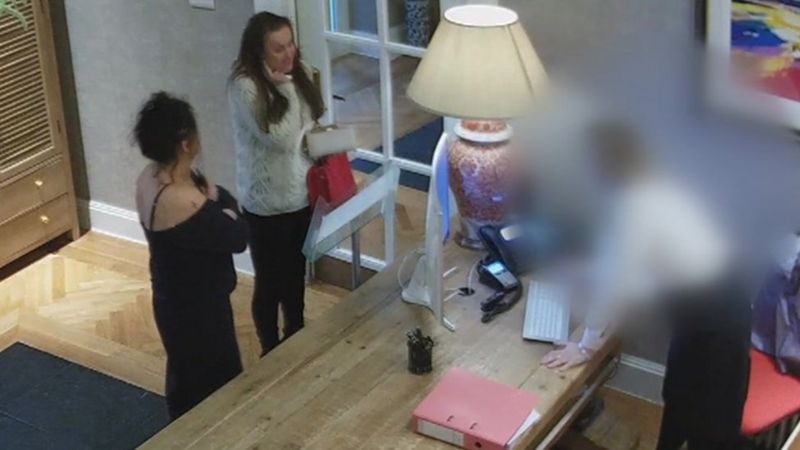
Locate an element on the screen. binder is located at coordinates (490, 427).